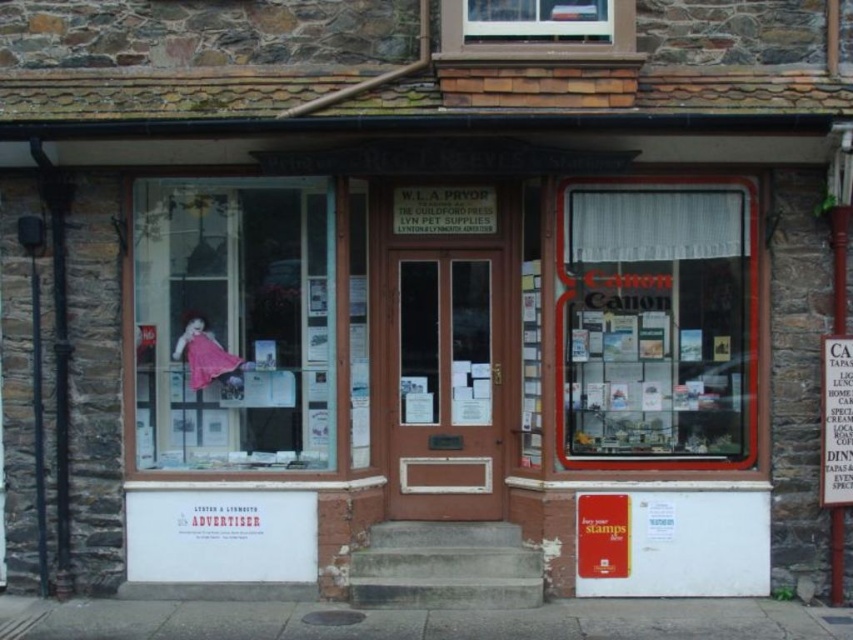
Question: Among these objects, which one is farthest from the camera?

Choices:
 (A) clear glass window at upper center
 (B) clear glass window at center
 (C) pink fabric dress at left
 (D) metallic silver sign at right

Answer: (B)

Question: Which object is positioned closest to the pink fabric dress at left?

Choices:
 (A) clear glass window at upper center
 (B) clear glass window at center
 (C) metallic silver sign at right

Answer: (A)

Question: Is the position of clear glass window at center less distant than that of clear glass window at upper center?

Choices:
 (A) yes
 (B) no

Answer: (B)

Question: Can you confirm if pink fabric dress at left is smaller than metallic silver sign at right?

Choices:
 (A) no
 (B) yes

Answer: (A)

Question: Is clear glass window at center above metallic silver sign at right?

Choices:
 (A) no
 (B) yes

Answer: (B)

Question: Which object is closer to the camera taking this photo?

Choices:
 (A) clear glass window at center
 (B) clear glass window at upper center
 (C) pink fabric dress at left

Answer: (B)